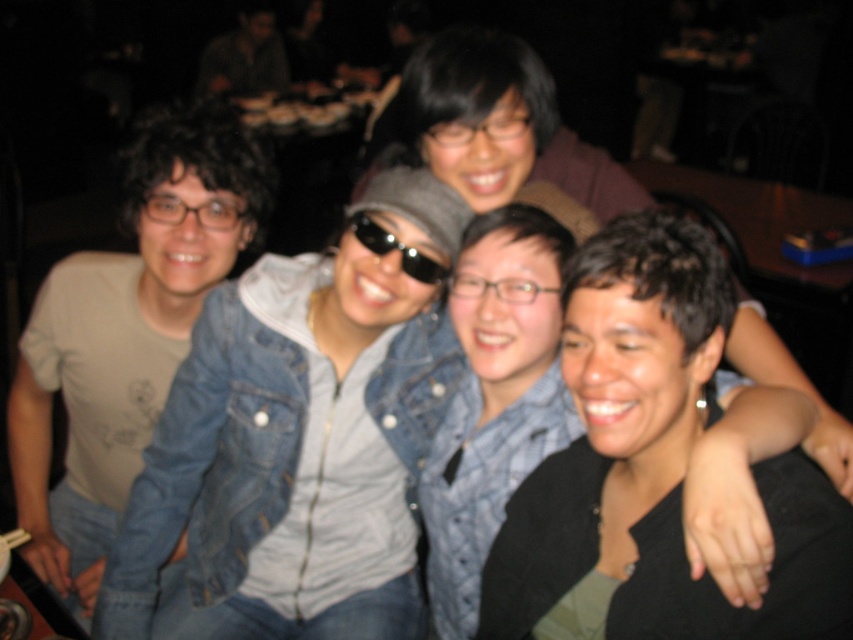
You are a photographer at the event and need to adjust the lighting to highlight the black matte jacket at center. Where exactly should you focus the light based on the coordinates provided?

The black matte jacket at center is located at coordinates point (653, 467), so focus the light there to highlight it.

You are at the center of the room and want to locate the black matte jacket at center. Which direction should you look to find it?

The black matte jacket at center is located at coordinates point (653,467), so you should look towards the lower right direction from the center of the room.